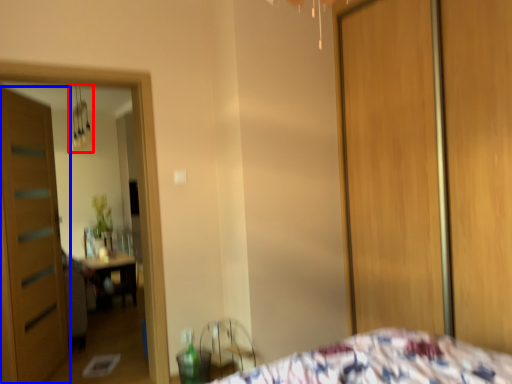
Question: Which point is further to the camera, light fixture (highlighted by a red box) or door (highlighted by a blue box)?

Choices:
 (A) light fixture
 (B) door

Answer: (A)